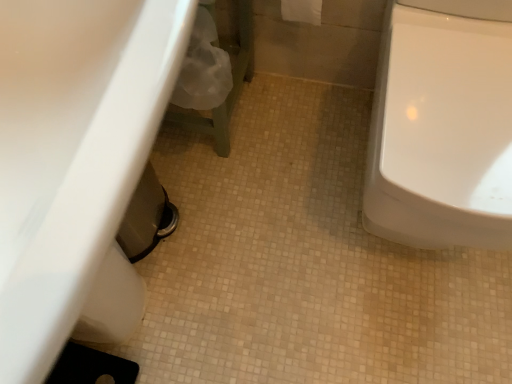
Question: Does white glossy sink at lower left have a greater width compared to white fabric toilet paper at upper center?

Choices:
 (A) no
 (B) yes

Answer: (B)

Question: From a real-world perspective, is white glossy sink at lower left on white fabric toilet paper at upper center?

Choices:
 (A) no
 (B) yes

Answer: (A)

Question: Is white glossy sink at lower left shorter than white fabric toilet paper at upper center?

Choices:
 (A) yes
 (B) no

Answer: (B)

Question: Is white fabric toilet paper at upper center at the back of white glossy sink at lower left?

Choices:
 (A) no
 (B) yes

Answer: (A)

Question: From the image's perspective, does white glossy sink at lower left appear lower than white fabric toilet paper at upper center?

Choices:
 (A) no
 (B) yes

Answer: (B)

Question: Is white glossy sink at lower left bigger than white fabric toilet paper at upper center?

Choices:
 (A) no
 (B) yes

Answer: (B)

Question: Is white glossy toilet at right closer to the viewer compared to white glossy sink at lower left?

Choices:
 (A) yes
 (B) no

Answer: (B)

Question: Can you confirm if white glossy toilet at right is taller than white glossy sink at lower left?

Choices:
 (A) yes
 (B) no

Answer: (B)

Question: From a real-world perspective, is white glossy toilet at right below white glossy sink at lower left?

Choices:
 (A) yes
 (B) no

Answer: (A)

Question: Can you confirm if white glossy toilet at right is bigger than white glossy sink at lower left?

Choices:
 (A) no
 (B) yes

Answer: (B)

Question: Is white glossy toilet at right to the right of white glossy sink at lower left from the viewer's perspective?

Choices:
 (A) yes
 (B) no

Answer: (A)

Question: From the image's perspective, is white glossy toilet at right over white glossy sink at lower left?

Choices:
 (A) no
 (B) yes

Answer: (B)

Question: Does white fabric toilet paper at upper center come behind white glossy sink at lower left?

Choices:
 (A) yes
 (B) no

Answer: (A)